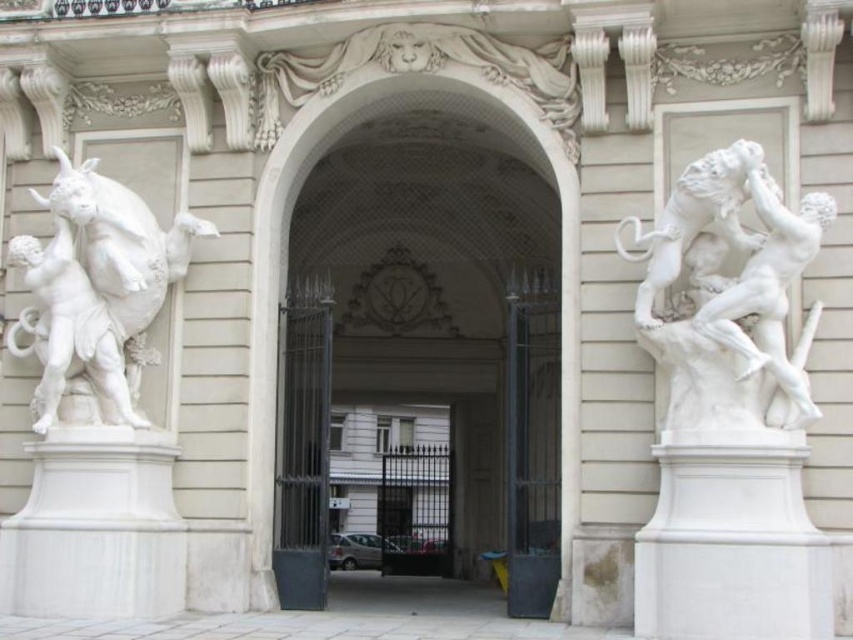
You are an architect examining the entrance of a grand building. You notice the white marble archway at center and the white marble statue at left. Based on their positions, which object is closer to the left edge of the entrance?

The white marble statue at left is closer to the left edge of the entrance because the white marble archway at center is positioned on the right side of it.

You are an architect designing a new garden pathway that must pass between the white marble statue at left and the white marble sculpture at right. Based on their widths, which side should you place the pathway closer to?

The white marble sculpture at right is thinner than the white marble statue at left, so the pathway should be placed closer to the white marble sculpture at right to ensure sufficient space between the statues.